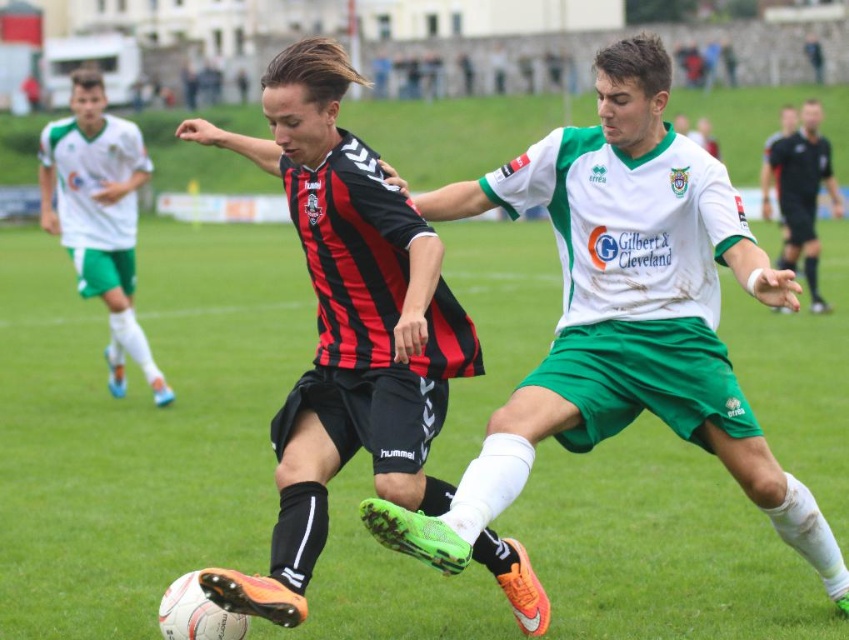
In the scene shown: You are a soccer player trying to pass the ball to a teammate. You notice two points on the field marked as point (x=55, y=195) and point (x=808, y=184). Which point is closer to your current position if you are standing behind both points?

Point (x=55, y=195) is behind point (x=808, y=184), so if you are standing behind both points, the closer point would be point (x=55, y=195).